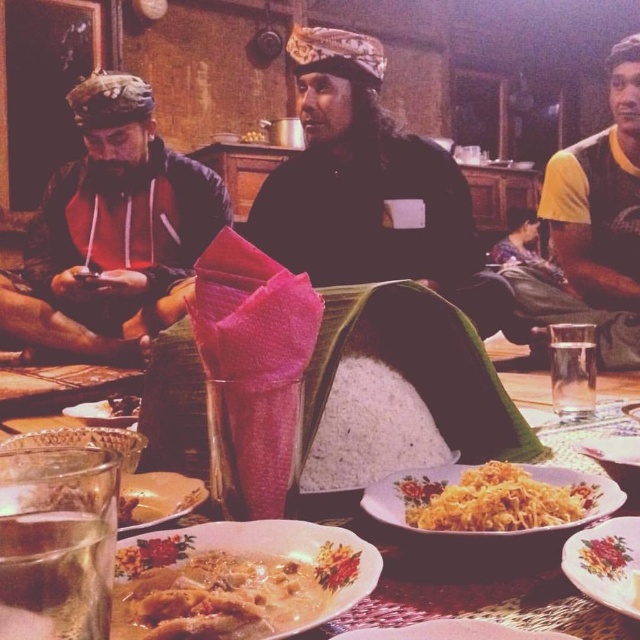
Can you confirm if matte black hoodie at left is positioned to the left of smooth white rice at center?

Correct, you'll find matte black hoodie at left to the left of smooth white rice at center.

Can you confirm if matte black hoodie at left is taller than smooth white rice at center?

Correct, matte black hoodie at left is much taller as smooth white rice at center.

Between point (74, 202) and point (112, 404), which one is positioned in front?

Point (112, 404) is more forward.

Locate an element on the screen. The width and height of the screenshot is (640, 640). matte black hoodie at left is located at coordinates (112, 234).

What do you see at coordinates (372, 192) in the screenshot? I see `matte black shirt at center` at bounding box center [372, 192].

Between matte black shirt at center and yellow rice at center, which one is positioned higher?

Positioned higher is matte black shirt at center.

Describe the element at coordinates (372, 192) in the screenshot. I see `matte black shirt at center` at that location.

The image size is (640, 640). Find the location of `matte black shirt at center`. matte black shirt at center is located at coordinates (372, 192).

Which is behind, point (8, 586) or point (118, 400)?

The point (118, 400) is more distant.

Can you confirm if translucent glass at lower left is positioned to the left of smooth white rice at center?

No, translucent glass at lower left is not to the left of smooth white rice at center.

I want to click on translucent glass at lower left, so click(58, 570).